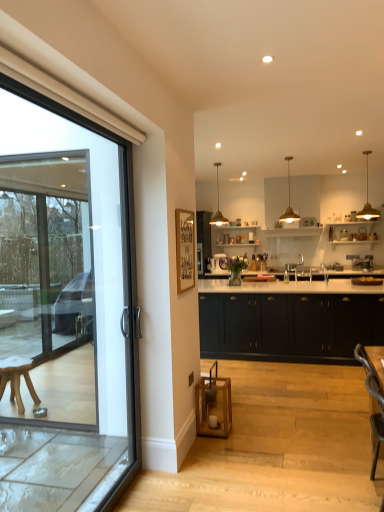
Question: From a real-world perspective, is matte black cabinets at center physically located above or below wooden armchair at lower right?

Choices:
 (A) below
 (B) above

Answer: (B)

Question: In terms of size, does matte black cabinets at center appear bigger or smaller than wooden armchair at lower right?

Choices:
 (A) big
 (B) small

Answer: (A)

Question: In the image, is matte black cabinets at center positioned in front of or behind wooden armchair at lower right?

Choices:
 (A) behind
 (B) front

Answer: (A)

Question: In terms of size, does wooden armchair at lower right appear bigger or smaller than matte black cabinets at center?

Choices:
 (A) small
 (B) big

Answer: (A)

Question: Looking at their shapes, would you say wooden armchair at lower right is wider or thinner than matte black cabinets at center?

Choices:
 (A) wide
 (B) thin

Answer: (B)

Question: From their relative heights in the image, would you say wooden armchair at lower right is taller or shorter than matte black cabinets at center?

Choices:
 (A) short
 (B) tall

Answer: (A)

Question: Which is correct: wooden armchair at lower right is inside matte black cabinets at center, or outside of it?

Choices:
 (A) inside
 (B) outside

Answer: (B)